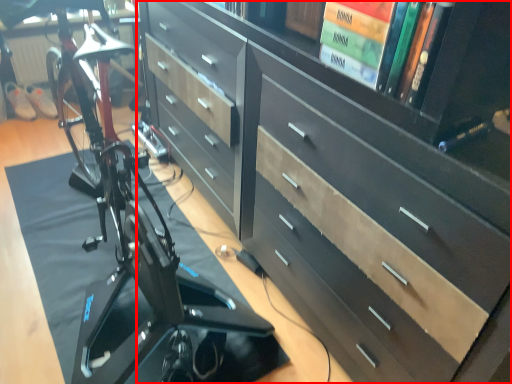
Question: In this image, where is chest of drawers (annotated by the red box) located relative to bicycle?

Choices:
 (A) left
 (B) right

Answer: (B)